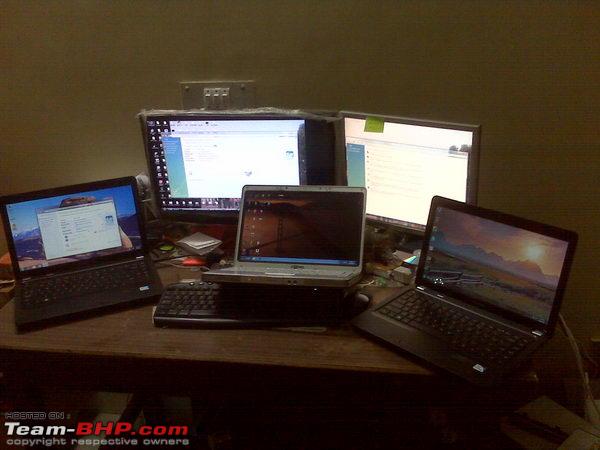
Identify the location of laptop. Image resolution: width=600 pixels, height=450 pixels. (84, 262).